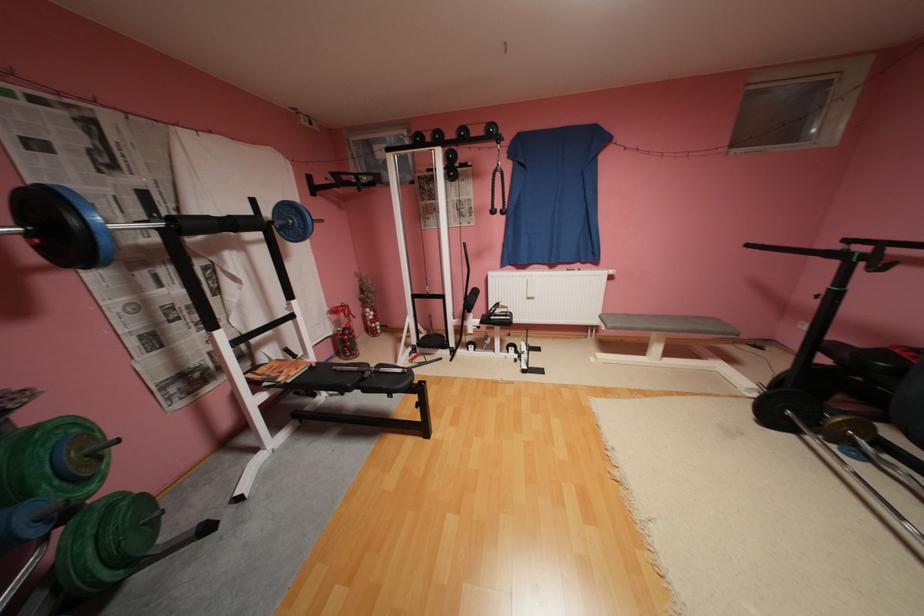
Where would you sit the grey bench surface? Please return your answer as a coordinate pair (x, y).

(655, 322)